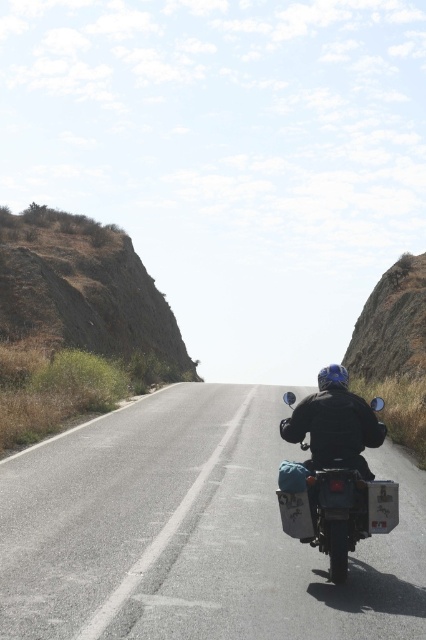
You are a GPS device trying to guide the motorcyclist to a nearby gas station. The gas station is located at point [192,532]. The motorcyclist is currently on the asphalt road at center. Can you confirm if the motorcyclist is already at the gas station?

The asphalt road at center is located at point [192,532], so yes, the motorcyclist is already at the gas station.

Looking at this image, you are a traveler planning to cross the asphalt road at center on foot. Considering the size of the road compared to the matte black motorcycle at center, would you estimate the road to be wide enough to safely allow the motorcycle to pass while you remain on the road?

The asphalt road at center is bigger than the matte black motorcycle at center. Since the road is larger, it should provide sufficient space for the motorcycle to pass safely while you stay on the road.

You are a delivery driver who needs to deliver a package to a location on the asphalt road at center. Your vehicle is 10 feet long. Can you safely park your vehicle on the matte black motorcycle at center without overlapping it?

The asphalt road at center is 13.20 feet away from matte black motorcycle at center. Since your vehicle is 10 feet long, it can be parked safely without overlapping the motorcycle as there is enough space between them.